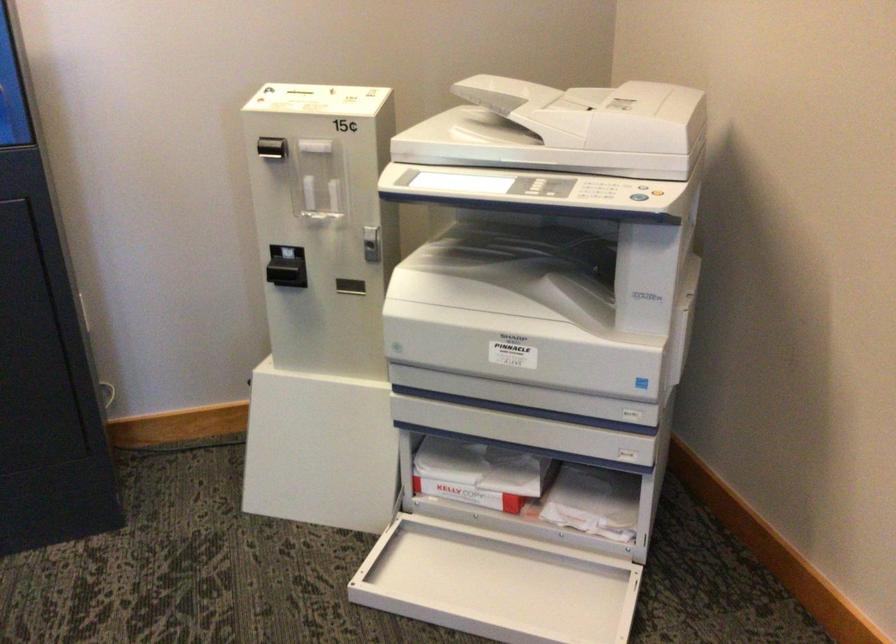
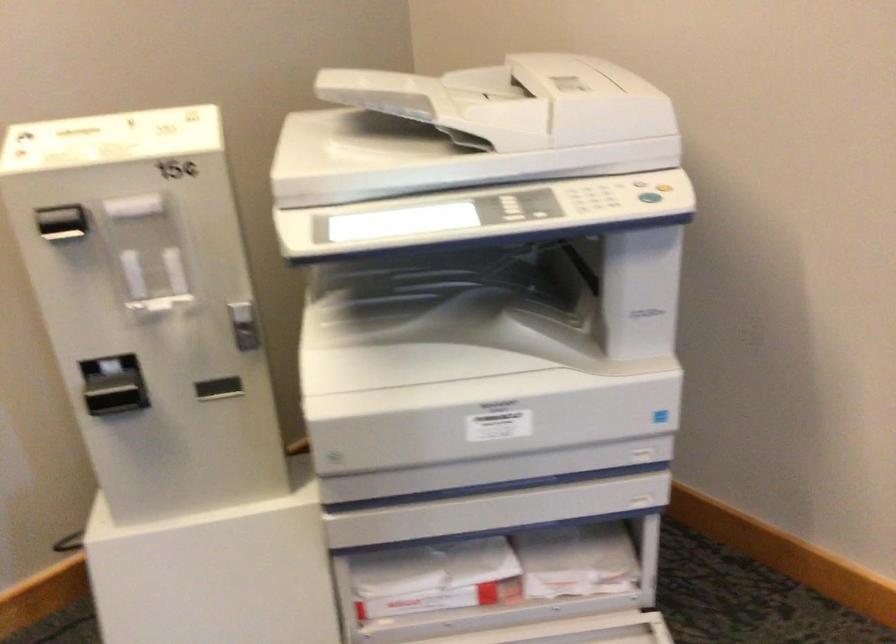
Locate, in the second image, the point that corresponds to the point at 522,126 in the first image.

(470, 129)